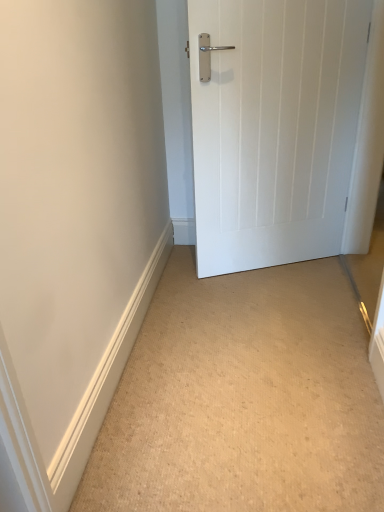
Where is `vacant space underneath white wooden door at right (from a real-world perspective)`? vacant space underneath white wooden door at right (from a real-world perspective) is located at coordinates (277, 263).